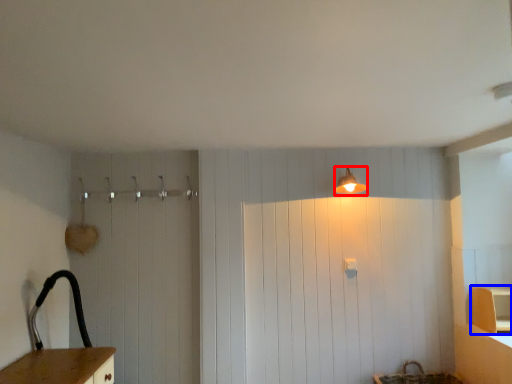
Question: Which point is closer to the camera, light fixture (highlighted by a red box) or cabinetry (highlighted by a blue box)?

Choices:
 (A) light fixture
 (B) cabinetry

Answer: (B)